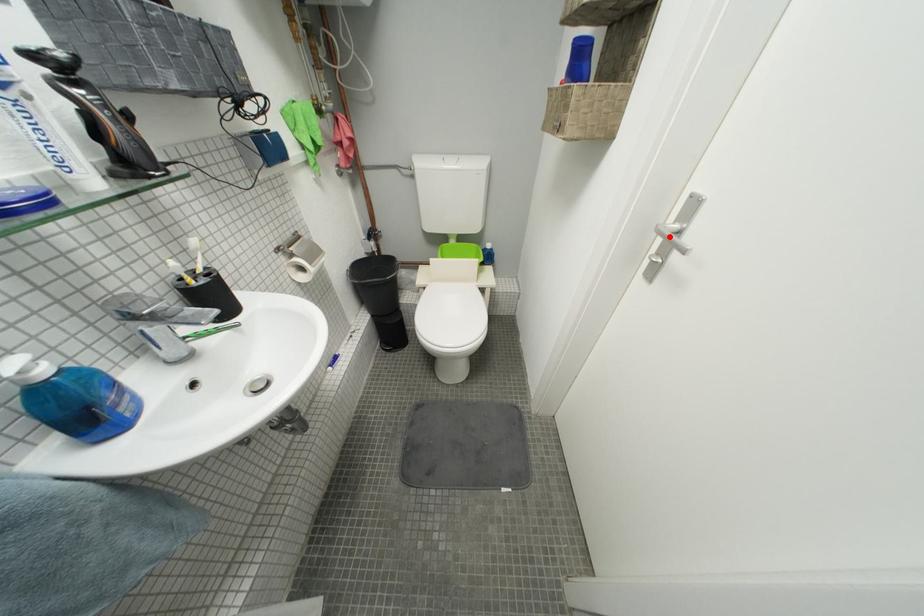
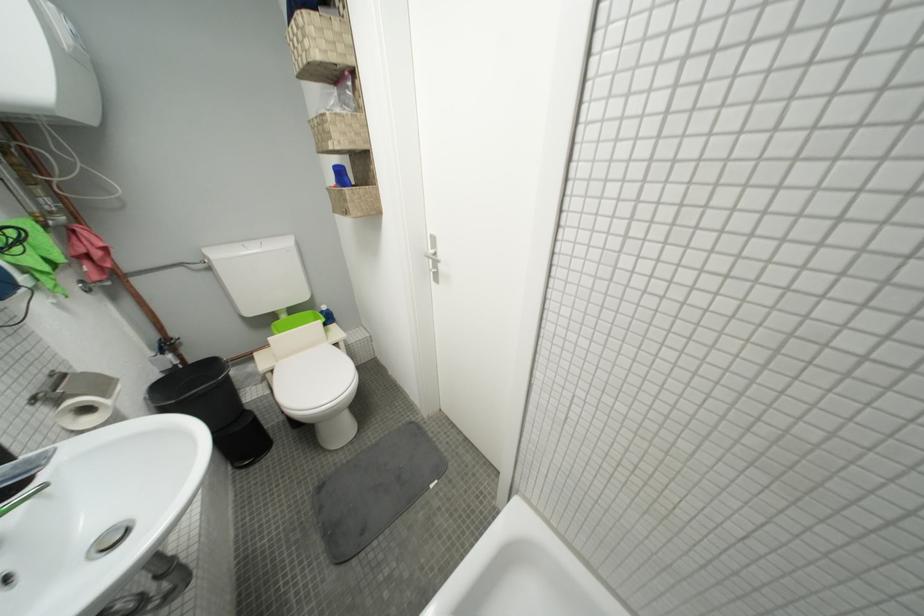
In the second image, find the point that corresponds to the highlighted location in the first image.

(438, 261)